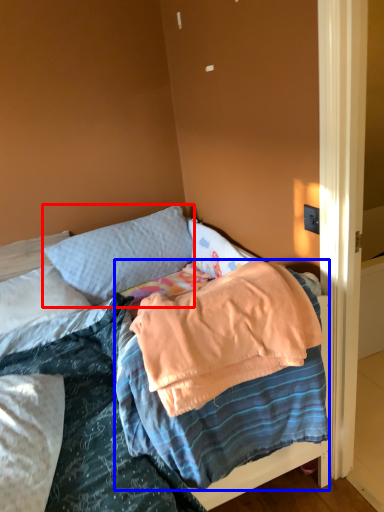
Question: Which point is further to the camera, pillow (highlighted by a red box) or blanket (highlighted by a blue box)?

Choices:
 (A) pillow
 (B) blanket

Answer: (A)